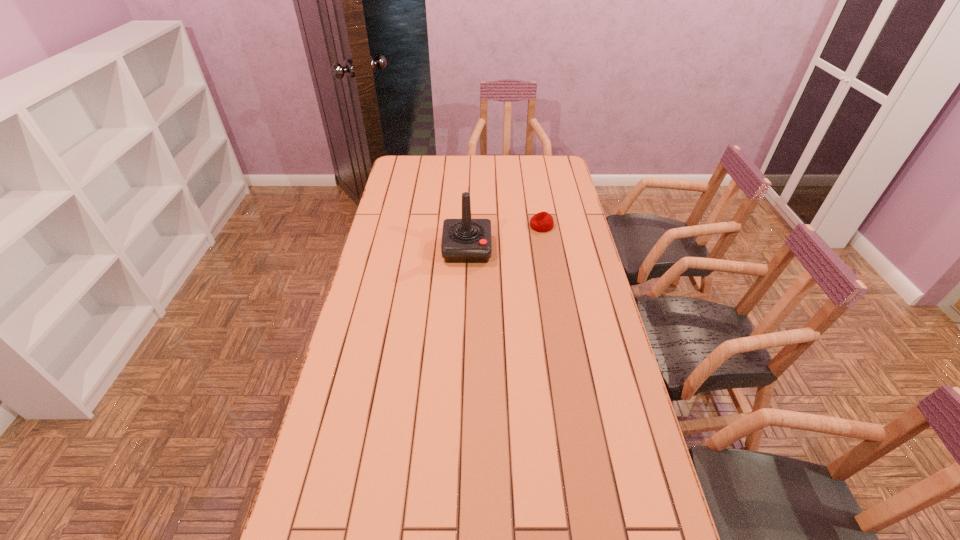
Locate an element on the screen. the nearer object is located at coordinates (466, 240).

Locate an element on the screen. joystick is located at coordinates (466, 240).

Locate an element on the screen. Image resolution: width=960 pixels, height=540 pixels. the shorter object is located at coordinates (541, 222).

Where is `the right object`? The width and height of the screenshot is (960, 540). the right object is located at coordinates 541,222.

You are a GUI agent. You are given a task and a screenshot of the screen. Output one action in this format:
    pyautogui.click(x=<x>, y=<y>)
    Task: Click on the vacant space located on the front-facing side of the nearer object
    
    Given the screenshot: What is the action you would take?
    pyautogui.click(x=466, y=286)

Locate an element on the screen. This screenshot has width=960, height=540. vacant space located 0.330m on the seat area of the shorter object is located at coordinates (450, 226).

Where is `vacant space located on the seat area of the shorter object`? The height and width of the screenshot is (540, 960). vacant space located on the seat area of the shorter object is located at coordinates (486, 226).

Where is `vacant region located 0.110m on the seat area of the shorter object`? The width and height of the screenshot is (960, 540). vacant region located 0.110m on the seat area of the shorter object is located at coordinates (503, 226).

Locate an element on the screen. This screenshot has height=540, width=960. object located at the right edge is located at coordinates (541, 222).

Find the location of `free space at the left edge of the desktop`. free space at the left edge of the desktop is located at coordinates (365, 468).